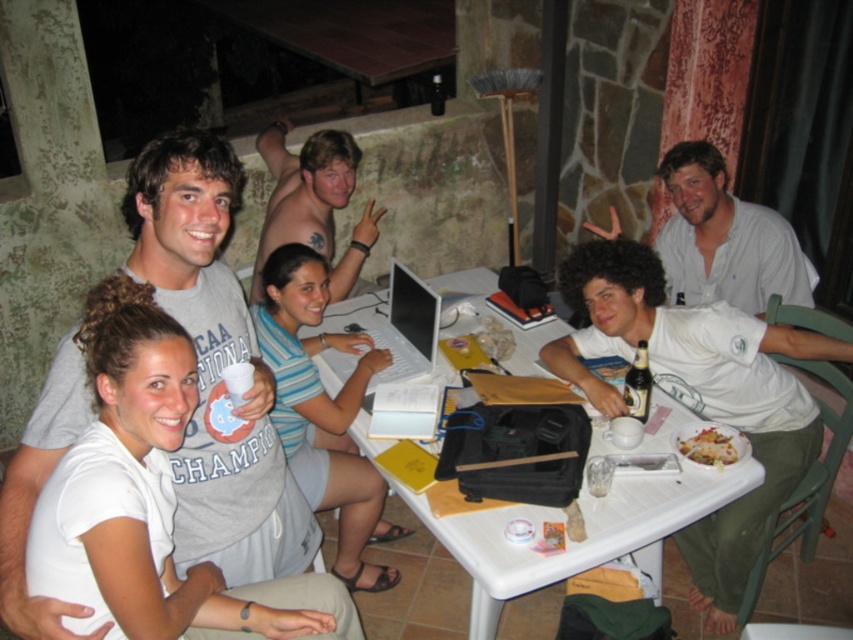
You are at a nighttime gathering around a white plastic table. There is a white plastic laptop at center. Where is the laptop positioned relative to the table?

The white plastic laptop at center is located at the coordinates point (402, 324) on the table.

You are a photographer standing in front of the group and want to take a photo that includes both the white cotton shirt at center and the white glossy plate at lower center. Which object will appear larger in the photo?

The white cotton shirt at center will appear larger in the photo because it is closer to the photographer than the white glossy plate at lower center.